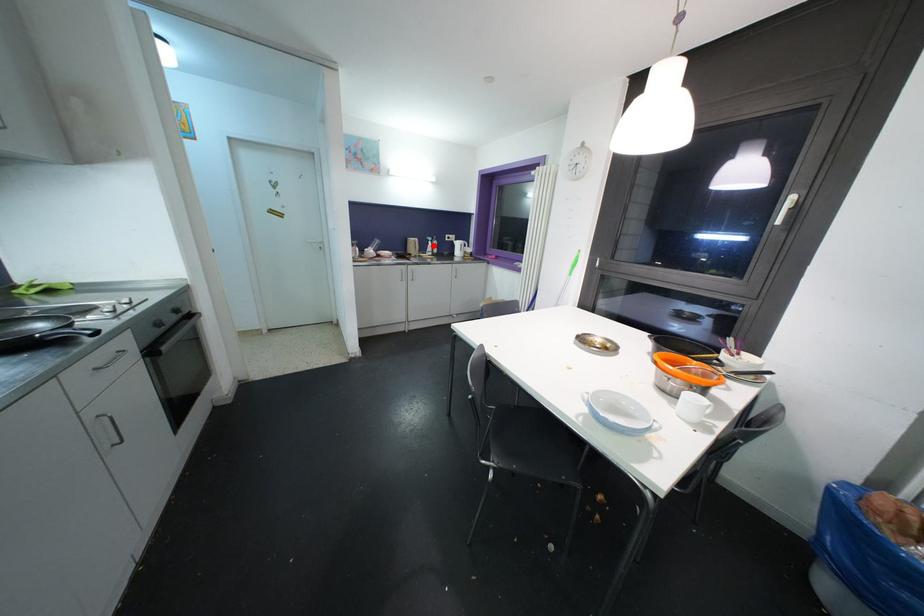
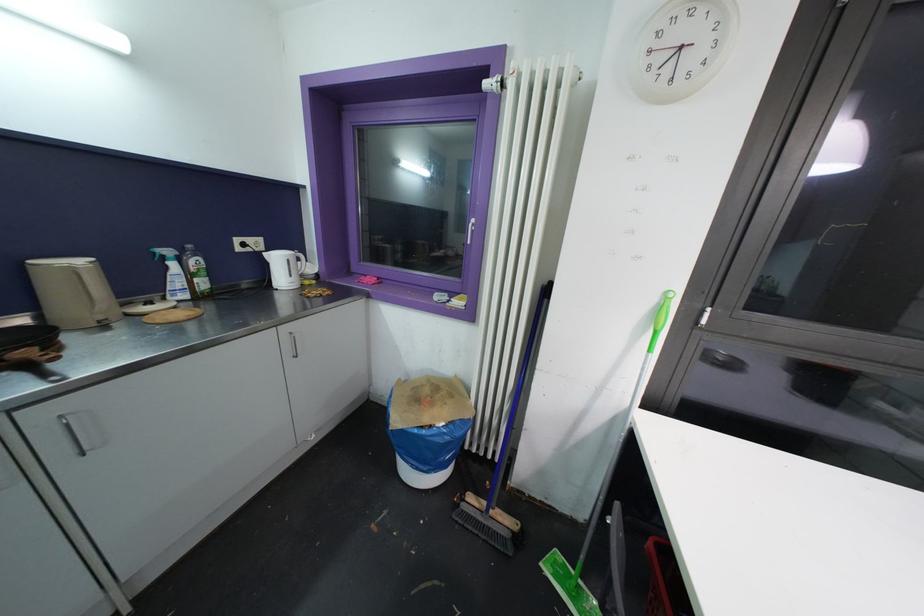
Question: A red point is marked in image1. In image2, is the corresponding 3D point closer to the camera or farther? Reply with the corresponding letter.

Choices:
 (A) The corresponding 3D point is closer.
 (B) The corresponding 3D point is farther.

Answer: (B)